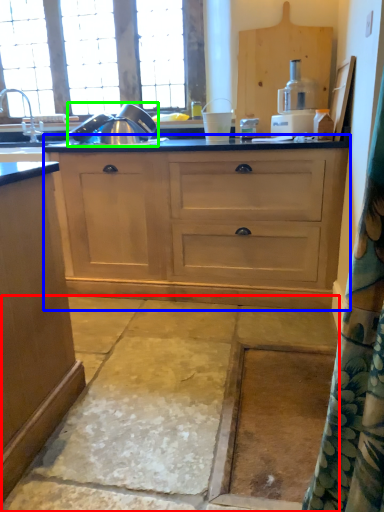
Question: Based on their relative distances, which object is farther from concrete (highlighted by a red box)? Choose from cupboard (highlighted by a blue box) and appliance (highlighted by a green box).

Choices:
 (A) cupboard
 (B) appliance

Answer: (B)